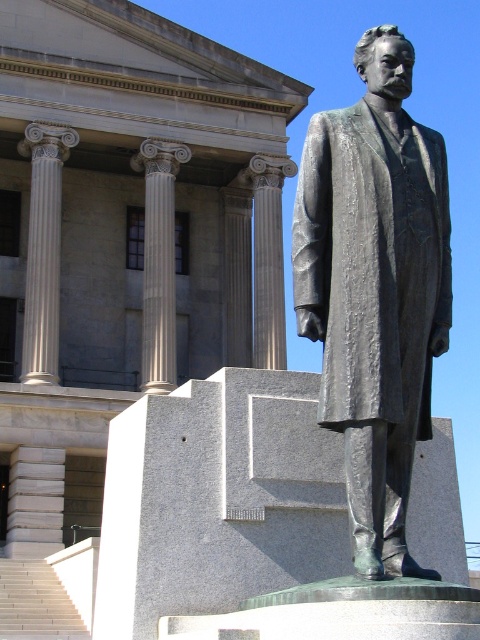
Question: Is bronze statue at center closer to camera compared to sanded stone column at center?

Choices:
 (A) no
 (B) yes

Answer: (B)

Question: From the image, what is the correct spatial relationship of white marble column at center in relation to sanded stone column at center?

Choices:
 (A) right
 (B) left

Answer: (B)

Question: Can you confirm if bronze statue at center is positioned above white wooden stairs at lower left?

Choices:
 (A) yes
 (B) no

Answer: (A)

Question: Which point is closer to the camera taking this photo?

Choices:
 (A) (235, 209)
 (B) (148, 172)
 (C) (277, 275)

Answer: (B)

Question: Considering the real-world distances, which object is closest to the bronze statue at center?

Choices:
 (A) white marble column at center
 (B) white marble column at left

Answer: (B)

Question: Which is nearer to the white marble column at center?

Choices:
 (A) sanded stone column at center
 (B) gray stone column at center
 (C) white marble column at left

Answer: (C)